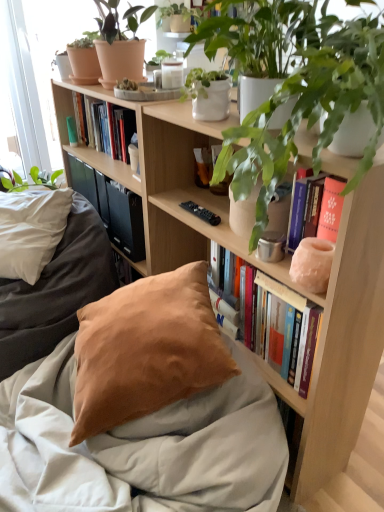
Question: Based on their sizes in the image, would you say matte pink stone vase at upper right, positioned as the first book in right-to-left order, is bigger or smaller than satin beige pillow at lower center?

Choices:
 (A) big
 (B) small

Answer: (B)

Question: Would you say matte pink stone vase at upper right, which is the 2th book in left-to-right order, is to the left or to the right of satin beige pillow at lower center in the picture?

Choices:
 (A) right
 (B) left

Answer: (A)

Question: Estimate the real-world distances between objects in this image. Which object is farther from the matte terracotta pot at upper left, positioned as the 1th houseplant in left-to-right order?

Choices:
 (A) suede-like tan pillow at lower left
 (B) terracotta clay pot at upper left
 (C) black matte book at center
 (D) matte pink stone vase at upper right, which is the 2th book in left-to-right order
 (E) hardcover books at upper center, which ranks as the 1th book in top-to-bottom order

Answer: (D)

Question: Which object is positioned closest to the satin beige pillow at lower center?

Choices:
 (A) suede-like tan pillow at lower left
 (B) terracotta clay pot at upper left
 (C) matte terracotta pot at upper left, the 1th houseplant viewed from the back
 (D) matte pink stone vase at upper right, marked as the second book in a top-to-bottom arrangement
 (E) green matte plant at upper right, which is the first houseplant from bottom to top

Answer: (A)